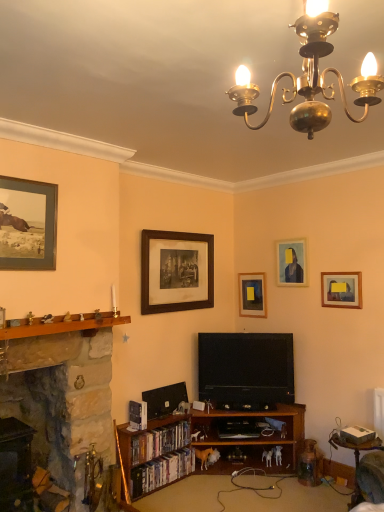
Where is `wooden picture frame at center, placed as the third picture frame when sorted from left to right`? wooden picture frame at center, placed as the third picture frame when sorted from left to right is located at coordinates [252, 295].

The height and width of the screenshot is (512, 384). In order to click on wooden bookshelf at lower center in this screenshot , I will do coord(248,438).

What is the approximate width of matte wooden picture frame at upper right, the fourth picture frame from the left?

matte wooden picture frame at upper right, the fourth picture frame from the left, is 1.34 inches in width.

How much space does wooden framed print at center, which ranks as the 3th picture frame in back-to-front order, occupy horizontally?

The width of wooden framed print at center, which ranks as the 3th picture frame in back-to-front order, is 2.11 inches.

The image size is (384, 512). Describe the element at coordinates (61, 326) in the screenshot. I see `wooden at left` at that location.

Measure the distance between black matte television at center and camera.

black matte television at center is 3.71 meters from camera.

The image size is (384, 512). Find the location of `wooden picture frame at center, the 1th picture frame when ordered from back to front`. wooden picture frame at center, the 1th picture frame when ordered from back to front is located at coordinates (252, 295).

From the image's perspective, which one is positioned lower, matte wooden picture frame at upper right, which is counted as the fourth picture frame, starting from the front, or matte yellow portrait at upper right, the first picture frame when ordered from right to left?

From the image's view, matte yellow portrait at upper right, the first picture frame when ordered from right to left, is below.

Is matte wooden picture frame at upper right, arranged as the 2th picture frame when viewed from the back, bigger or smaller than matte yellow portrait at upper right, which is the 2th picture frame in front-to-back order?

Considering their sizes, matte wooden picture frame at upper right, arranged as the 2th picture frame when viewed from the back, takes up more space than matte yellow portrait at upper right, which is the 2th picture frame in front-to-back order.

Is matte wooden picture frame at upper right, which is counted as the 2th picture frame, starting from the right, situated inside matte yellow portrait at upper right, which is the 2th picture frame in front-to-back order, or outside?

matte wooden picture frame at upper right, which is counted as the 2th picture frame, starting from the right, is outside matte yellow portrait at upper right, which is the 2th picture frame in front-to-back order.

Which point is more forward, (x=298, y=247) or (x=335, y=288)?

The point (x=335, y=288) is in front.

Can you confirm if black glossy bookshelf at lower left, placed as the 2th book when sorted from top to bottom, is wider than stone fireplace at left?

No.

Does point (140, 477) appear closer or farther from the camera than point (66, 344)?

Point (140, 477).

Between black glossy bookshelf at lower left, placed as the 2th book when sorted from top to bottom, and stone fireplace at left, which one appears on the right side from the viewer's perspective?

Positioned to the right is black glossy bookshelf at lower left, placed as the 2th book when sorted from top to bottom.

Considering the positions of objects black matte television at center and black glossy bookshelf at lower left, placed as the 2th book when sorted from top to bottom, in the image provided, who is more to the left, black matte television at center or black glossy bookshelf at lower left, placed as the 2th book when sorted from top to bottom,?

black glossy bookshelf at lower left, placed as the 2th book when sorted from top to bottom, is more to the left.

From the image's perspective, is black matte television at center located beneath black glossy bookshelf at lower left, placed as the 2th book when sorted from top to bottom?

No.

Considering the sizes of objects black matte television at center and black glossy bookshelf at lower left, placed as the 2th book when sorted from top to bottom, in the image provided, who is wider, black matte television at center or black glossy bookshelf at lower left, placed as the 2th book when sorted from top to bottom,?

black matte television at center.

Considering the positions of points (299, 408) and (260, 288), is point (299, 408) closer to camera compared to point (260, 288)?

Yes, point (299, 408) is in front of point (260, 288).

Would you say wooden bookshelf at lower center is a long distance from wooden picture frame at center, which is counted as the fifth picture frame, starting from the front?

Yes, wooden bookshelf at lower center and wooden picture frame at center, which is counted as the fifth picture frame, starting from the front, are quite far apart.

Considering their positions, is wooden bookshelf at lower center located in front of or behind wooden picture frame at center, which is counted as the fifth picture frame, starting from the front?

wooden bookshelf at lower center is positioned closer to the viewer than wooden picture frame at center, which is counted as the fifth picture frame, starting from the front.

Can you confirm if wooden bookshelf at lower center is smaller than wooden picture frame at center, placed as the third picture frame when sorted from left to right?

Incorrect, wooden bookshelf at lower center is not smaller in size than wooden picture frame at center, placed as the third picture frame when sorted from left to right.

From the image's perspective, relative to hardcover books at lower center, positioned as the first book in top-to-bottom order, is matte yellow portrait at upper right, arranged as the fifth picture frame when viewed from the left, above or below?

Based on their image positions, matte yellow portrait at upper right, arranged as the fifth picture frame when viewed from the left, is located above hardcover books at lower center, positioned as the first book in top-to-bottom order.

How different are the orientations of matte yellow portrait at upper right, the first picture frame when ordered from right to left, and hardcover books at lower center, the second book in the bottom-to-top sequence, in degrees?

The facing directions of matte yellow portrait at upper right, the first picture frame when ordered from right to left, and hardcover books at lower center, the second book in the bottom-to-top sequence, are 90.5 degrees apart.

From a real-world perspective, is matte yellow portrait at upper right, which is the 2th picture frame in front-to-back order, located beneath hardcover books at lower center, the second book in the bottom-to-top sequence?

No, from a real-world perspective, matte yellow portrait at upper right, which is the 2th picture frame in front-to-back order, is not below hardcover books at lower center, the second book in the bottom-to-top sequence.

Between matte yellow portrait at upper right, the first picture frame when ordered from right to left, and hardcover books at lower center, positioned as the first book in top-to-bottom order, which one is positioned in front?

Positioned in front is hardcover books at lower center, positioned as the first book in top-to-bottom order.

Would you say wooden at left is outside black glossy bookshelf at lower left, placed as the 2th book when sorted from top to bottom?

wooden at left is positioned outside black glossy bookshelf at lower left, placed as the 2th book when sorted from top to bottom.

From a real-world perspective, which is physically above, wooden at left or black glossy bookshelf at lower left, placed as the 2th book when sorted from top to bottom?

From a 3D spatial view, wooden at left is above.

How different are the orientations of wooden at left and black glossy bookshelf at lower left, placed as the 2th book when sorted from top to bottom, in degrees?

There is a 1.38-degree angle between the facing directions of wooden at left and black glossy bookshelf at lower left, placed as the 2th book when sorted from top to bottom.

Can you confirm if wooden at left is wider than black glossy bookshelf at lower left, the first book when ordered from bottom to top?

Indeed, wooden at left has a greater width compared to black glossy bookshelf at lower left, the first book when ordered from bottom to top.

Is wooden bookshelf at lower center smaller than wooden framed print at center, which is counted as the third picture frame, starting from the front?

No, wooden bookshelf at lower center is not smaller than wooden framed print at center, which is counted as the third picture frame, starting from the front.

Is wooden bookshelf at lower center with wooden framed print at center, arranged as the 2th picture frame when viewed from the left?

No, wooden bookshelf at lower center is not beside wooden framed print at center, arranged as the 2th picture frame when viewed from the left.

From a real-world perspective, relative to wooden framed print at center, arranged as the 2th picture frame when viewed from the left, is wooden bookshelf at lower center vertically above or below?

In terms of real-world spatial position, wooden bookshelf at lower center is below wooden framed print at center, arranged as the 2th picture frame when viewed from the left.

Which is correct: wooden bookshelf at lower center is inside wooden framed print at center, which is the 4th picture frame in right-to-left order, or outside of it?

wooden bookshelf at lower center is outside wooden framed print at center, which is the 4th picture frame in right-to-left order.

Where is `the 2nd picture frame in front when counting from the matte wooden picture frame at upper right, which is counted as the fourth picture frame, starting from the front`? The height and width of the screenshot is (512, 384). the 2nd picture frame in front when counting from the matte wooden picture frame at upper right, which is counted as the fourth picture frame, starting from the front is located at coordinates (341, 289).

This screenshot has width=384, height=512. Find the location of `book that is the 1st one when counting backward from the stone fireplace at left`. book that is the 1st one when counting backward from the stone fireplace at left is located at coordinates (161, 471).

Which object lies nearer to the anchor point hardcover books at lower center, the second book in the bottom-to-top sequence, wooden at left or wooden framed print at center, which is counted as the third picture frame, starting from the front?

wooden at left is positioned closer to the anchor hardcover books at lower center, the second book in the bottom-to-top sequence.

Looking at the image, which one is located closer to black glossy bookshelf at lower left, the first book when ordered from bottom to top, black matte television at center or matte wooden picture frame at upper left, the first picture frame from the front?

black matte television at center is closer to black glossy bookshelf at lower left, the first book when ordered from bottom to top.

Based on their spatial positions, is wooden bookshelf at lower center or wooden round table at lower right further from matte yellow portrait at upper right, which is the 2th picture frame in front-to-back order?

wooden bookshelf at lower center lies further to matte yellow portrait at upper right, which is the 2th picture frame in front-to-back order, than the other object.

Which object lies further to the anchor point black glossy bookshelf at lower left, the first book when ordered from bottom to top, black matte television at center or hardcover books at lower center, positioned as the first book in top-to-bottom order?

black matte television at center is further to black glossy bookshelf at lower left, the first book when ordered from bottom to top.

Looking at the image, which one is located further to black matte television at center, matte yellow portrait at upper right, which is the 2th picture frame in front-to-back order, or wooden framed print at center, which is counted as the third picture frame, starting from the front?

matte yellow portrait at upper right, which is the 2th picture frame in front-to-back order, lies further to black matte television at center than the other object.

Based on the photo, from the image, which object appears to be farther from hardcover books at lower center, the second book in the bottom-to-top sequence, stone fireplace at left or black glossy bookshelf at lower left, the first book when ordered from bottom to top?

stone fireplace at left is positioned further to the anchor hardcover books at lower center, the second book in the bottom-to-top sequence.

Based on their spatial positions, is matte yellow portrait at upper right, arranged as the fifth picture frame when viewed from the left, or black matte television at center further from wooden bookshelf at lower center?

Among the two, matte yellow portrait at upper right, arranged as the fifth picture frame when viewed from the left, is located further to wooden bookshelf at lower center.

Based on the photo, estimate the real-world distances between objects in this image. Which object is further from wooden round table at lower right, black matte television at center or wooden picture frame at center, the 1th picture frame when ordered from back to front?

wooden picture frame at center, the 1th picture frame when ordered from back to front, is positioned further to the anchor wooden round table at lower right.

Where is `book between wooden picture frame at center, which is counted as the fifth picture frame, starting from the front, and black glossy bookshelf at lower left, placed as the 2th book when sorted from top to bottom, vertically`? This screenshot has height=512, width=384. book between wooden picture frame at center, which is counted as the fifth picture frame, starting from the front, and black glossy bookshelf at lower left, placed as the 2th book when sorted from top to bottom, vertically is located at coordinates (159, 441).

Locate an element on the screen. This screenshot has width=384, height=512. television between wooden framed print at center, arranged as the 2th picture frame when viewed from the left, and black glossy bookshelf at lower left, placed as the 2th book when sorted from top to bottom, from top to bottom is located at coordinates (246, 369).

Locate an element on the screen. fireplace between wooden framed print at center, which ranks as the 3th picture frame in back-to-front order, and wooden bookshelf at lower center from top to bottom is located at coordinates (62, 393).

In order to click on shelf between matte wooden picture frame at upper left, the first picture frame from the front, and wooden bookshelf at lower center, in the vertical direction in this screenshot , I will do `click(61, 326)`.